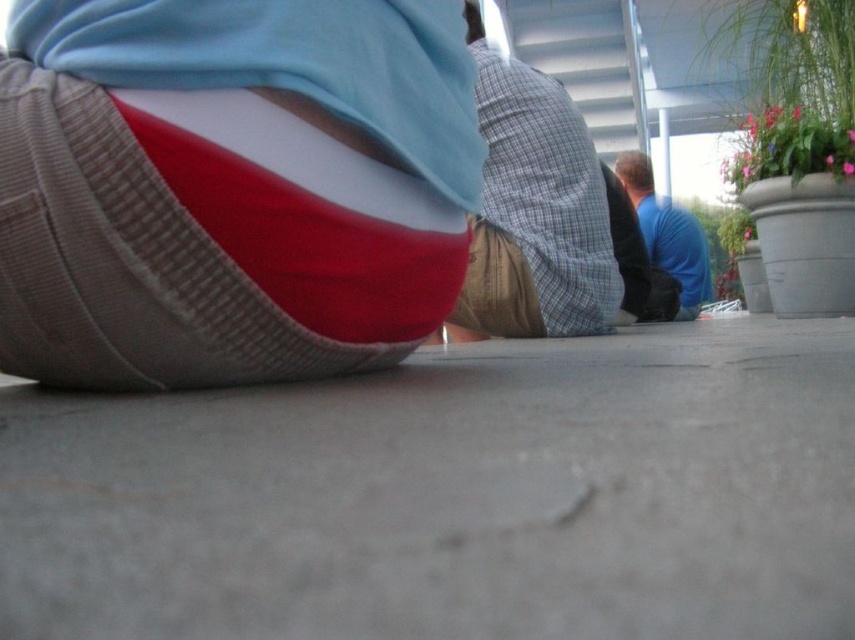
You are a photographer trying to capture both the plaid fabric shirt at center and the blue cotton shirt at upper right in a single shot. Based on their positions, which shirt would appear closer to the camera?

The plaid fabric shirt at center appears closer to the camera because it is shorter than the blue cotton shirt at upper right.

You are a photographer setting up a shot of the scene described. You notice the gray concrete pavement at lower center and the plaid fabric shirt at center. Which object would appear larger in your photo?

The plaid fabric shirt at center appears larger in the photo because it is bigger than the gray concrete pavement at lower center.

You are a photographer trying to capture a group photo of the plaid fabric shirt at center and the blue cotton shirt at upper right. Given that your camera has a maximum focus range of 5 feet, will both subjects be in focus?

The distance between the plaid fabric shirt at center and the blue cotton shirt at upper right is 5.72 feet, which exceeds the camera maximum focus range of 5 feet. Therefore, both subjects cannot be in focus at the same time.